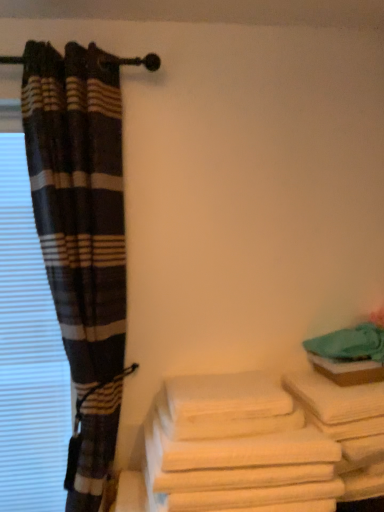
At what (x,y) coordinates should I click in order to perform the action: click on white cotton towels at lower right. Please return your answer as a coordinate pair (x, y). Image resolution: width=384 pixels, height=512 pixels. Looking at the image, I should click on (235, 445).

At what (x,y) coordinates should I click in order to perform the action: click on plaid fabric curtain at left. Please return your answer as a coordinate pair (x, y). Looking at the image, I should click on (81, 238).

At what (x,y) coordinates should I click in order to perform the action: click on white cotton towels at lower right. Please return your answer as a coordinate pair (x, y). This screenshot has width=384, height=512. Looking at the image, I should click on (235, 445).

Is white cotton towels at lower right turned away from white cotton bath towel at lower right?

white cotton towels at lower right is not turned away from white cotton bath towel at lower right.

In terms of height, does white cotton towels at lower right look taller or shorter compared to white cotton bath towel at lower right?

Clearly, white cotton towels at lower right is taller compared to white cotton bath towel at lower right.

In the scene shown: From the image's perspective, between white cotton towels at lower right and white cotton bath towel at lower right, which one is located above?

white cotton bath towel at lower right is shown above in the image.

Does white cotton towels at lower right contain white cotton bath towel at lower right?

No, white cotton bath towel at lower right is not surrounded by white cotton towels at lower right.

Can you confirm if white cotton bath towel at lower right is thinner than white blinds at left?

In fact, white cotton bath towel at lower right might be wider than white blinds at left.

From the image's perspective, is white cotton bath towel at lower right on top of white blinds at left?

Incorrect, from the image's perspective, white cotton bath towel at lower right is lower than white blinds at left.

Identify the location of bath towel on the right of white blinds at left. The width and height of the screenshot is (384, 512). (225, 397).

Does point (201, 404) come in front of point (7, 146)?

Yes, point (201, 404) is in front of point (7, 146).

Is plaid fabric curtain at left further to the viewer compared to white cotton towels at lower right?

Yes.

Does plaid fabric curtain at left have a smaller size compared to white cotton towels at lower right?

No, plaid fabric curtain at left is not smaller than white cotton towels at lower right.

From the image's perspective, is plaid fabric curtain at left below white cotton towels at lower right?

Incorrect, from the image's perspective, plaid fabric curtain at left is higher than white cotton towels at lower right.

Based on the photo, considering the positions of objects plaid fabric curtain at left and white cotton towels at lower right in the image provided, who is more to the left, plaid fabric curtain at left or white cotton towels at lower right?

plaid fabric curtain at left.

Is white cotton bath towel at lower right surrounded by white blinds at left?

No, white cotton bath towel at lower right is located outside of white blinds at left.

Does white blinds at left have a greater width compared to white cotton bath towel at lower right?

In fact, white blinds at left might be narrower than white cotton bath towel at lower right.

Is white blinds at left placed right next to white cotton bath towel at lower right?

There is a gap between white blinds at left and white cotton bath towel at lower right.

Looking at this image, is white blinds at left at the left side of white cotton towels at lower right?

Correct, you'll find white blinds at left to the left of white cotton towels at lower right.

Which object is closer to the camera taking this photo, white blinds at left or white cotton towels at lower right?

white cotton towels at lower right is closer to the camera.

Is white blinds at left outside of white cotton towels at lower right?

Yes, white blinds at left is located beyond the bounds of white cotton towels at lower right.

Is white blinds at left turned away from white cotton towels at lower right?

No, white cotton towels at lower right is not at the back of white blinds at left.

Is plaid fabric curtain at left spatially inside white blinds at left, or outside of it?

plaid fabric curtain at left exists outside the volume of white blinds at left.

Is point (50, 103) positioned behind point (14, 230)?

No, it is in front of (14, 230).

Between plaid fabric curtain at left and white blinds at left, which one has smaller size?

white blinds at left.

From a real-world perspective, is white cotton towels at lower right located higher than white blinds at left?

No.

Considering the positions of objects white cotton towels at lower right and white blinds at left in the image provided, who is behind, white cotton towels at lower right or white blinds at left?

white blinds at left is more distant.

From the image's perspective, is white cotton towels at lower right above or below white blinds at left?

white cotton towels at lower right is situated lower than white blinds at left in the image.

Is white cotton towels at lower right wider than white blinds at left?

Indeed, white cotton towels at lower right has a greater width compared to white blinds at left.

You are a GUI agent. You are given a task and a screenshot of the screen. Output one action in this format:
    pyautogui.click(x=<x>, y=<y>)
    Task: Click on the bath towel that appears above the white cotton towels at lower right (from the image's perspective)
    
    Given the screenshot: What is the action you would take?
    pyautogui.click(x=225, y=397)

This screenshot has height=512, width=384. I want to click on window on the left of white cotton bath towel at lower right, so click(x=28, y=353).

Based on the photo, estimate the real-world distances between objects in this image. Which object is further from white cotton bath towel at lower right, white blinds at left or white cotton towels at lower right?

white blinds at left is further to white cotton bath towel at lower right.

Estimate the real-world distances between objects in this image. Which object is further from white cotton towels at lower right, white cotton bath towel at lower right or plaid fabric curtain at left?

plaid fabric curtain at left is positioned further to the anchor white cotton towels at lower right.

Looking at the image, which one is located further to plaid fabric curtain at left, white cotton towels at lower right or white cotton bath towel at lower right?

white cotton towels at lower right.

Estimate the real-world distances between objects in this image. Which object is closer to white cotton towels at lower right, plaid fabric curtain at left or white cotton bath towel at lower right?

white cotton bath towel at lower right lies closer to white cotton towels at lower right than the other object.

From the image, which object appears to be farther from white cotton bath towel at lower right, white cotton towels at lower right or white blinds at left?

white blinds at left is positioned further to the anchor white cotton bath towel at lower right.

Looking at the image, which one is located closer to white cotton bath towel at lower right, white cotton towels at lower right or plaid fabric curtain at left?

white cotton towels at lower right.

Looking at the image, which one is located further to plaid fabric curtain at left, white blinds at left or white cotton towels at lower right?

white cotton towels at lower right.

Considering their positions, is white blinds at left positioned closer to plaid fabric curtain at left than white cotton bath towel at lower right?

white blinds at left.

Image resolution: width=384 pixels, height=512 pixels. Identify the location of curtain between white blinds at left and white cotton towels at lower right in the horizontal direction. (81, 238).

Image resolution: width=384 pixels, height=512 pixels. I want to click on bath towel situated between plaid fabric curtain at left and white cotton towels at lower right from left to right, so click(x=225, y=397).

The image size is (384, 512). What are the coordinates of `bath towel situated between white blinds at left and white cotton towels at lower right from left to right` in the screenshot? It's located at (225, 397).

Where is `curtain located between white blinds at left and white cotton bath towel at lower right in the left-right direction`? curtain located between white blinds at left and white cotton bath towel at lower right in the left-right direction is located at coordinates (81, 238).